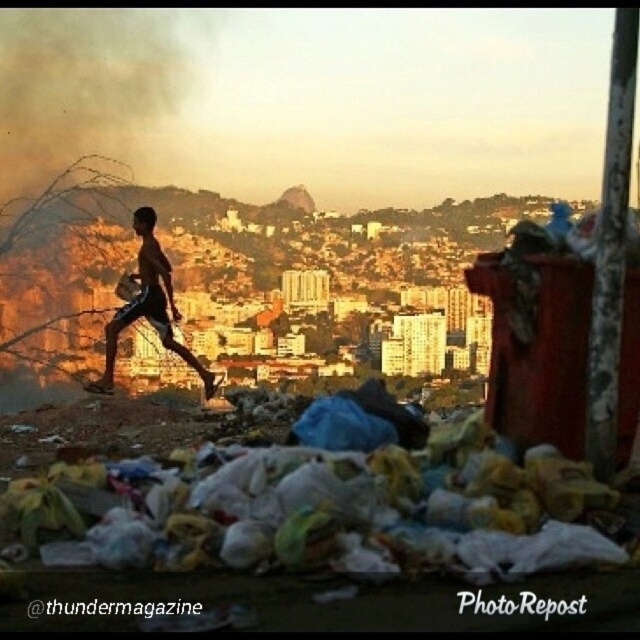
Question: Considering the relative positions of plastic bags at lower center and black smoke at upper left in the image provided, where is plastic bags at lower center located with respect to black smoke at upper left?

Choices:
 (A) above
 (B) below

Answer: (B)

Question: Which point is farther to the camera?

Choices:
 (A) shiny metallic shorts at left
 (B) plastic bags at lower center
 (C) black smoke at upper left

Answer: (C)

Question: Is black smoke at upper left positioned before shiny metallic shorts at left?

Choices:
 (A) no
 (B) yes

Answer: (A)

Question: Is plastic bags at lower center wider than shiny metallic shorts at left?

Choices:
 (A) no
 (B) yes

Answer: (B)

Question: Which of these objects is positioned closest to the shiny metallic shorts at left?

Choices:
 (A) black smoke at upper left
 (B) plastic bags at lower center

Answer: (A)

Question: Which point is farther to the camera?

Choices:
 (A) (97, 561)
 (B) (132, 278)

Answer: (B)